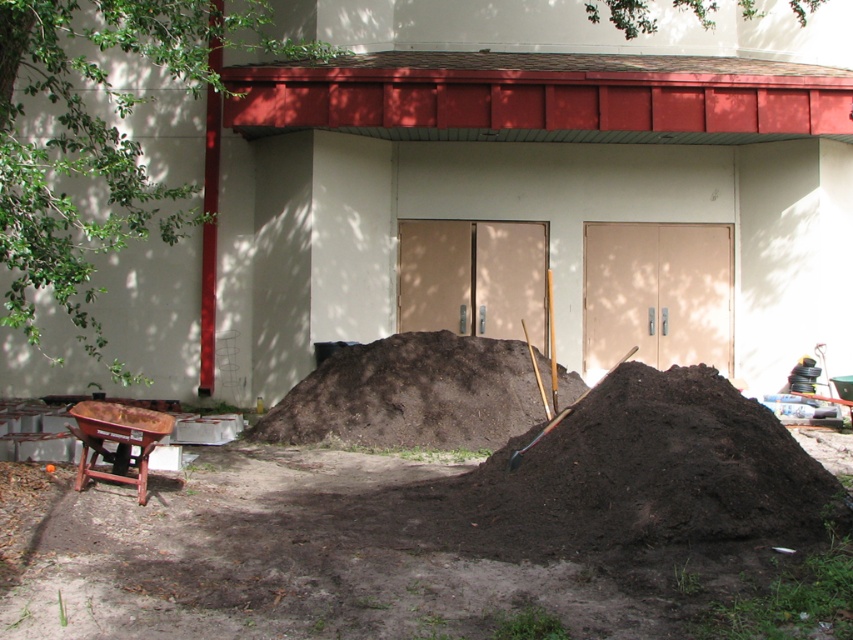
Does dark brown soil at center have a smaller size compared to metallic silver shovel at center?

Yes, dark brown soil at center is smaller than metallic silver shovel at center.

Describe the element at coordinates (410, 394) in the screenshot. This screenshot has width=853, height=640. I see `dark brown soil at center` at that location.

Find the location of a particular element. dark brown soil at center is located at coordinates (410, 394).